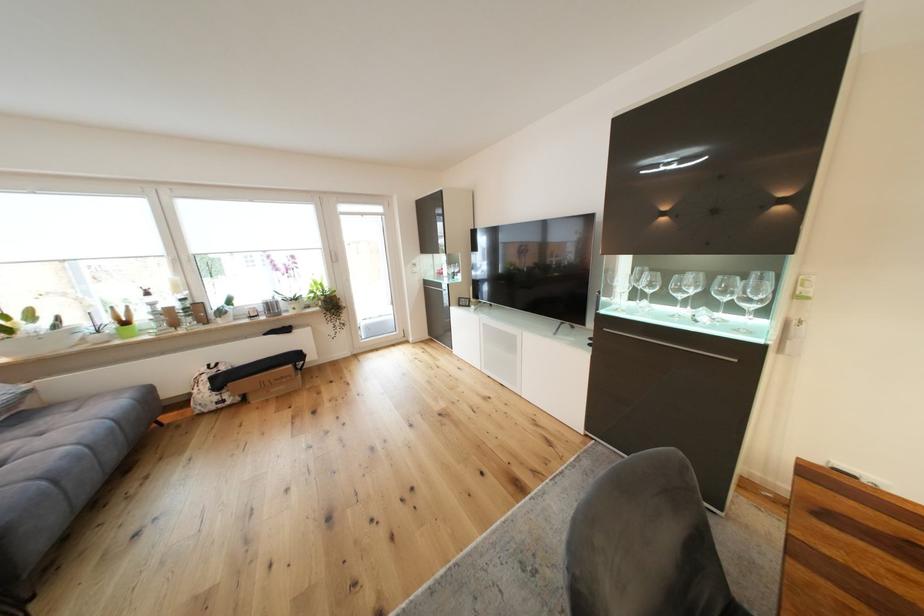
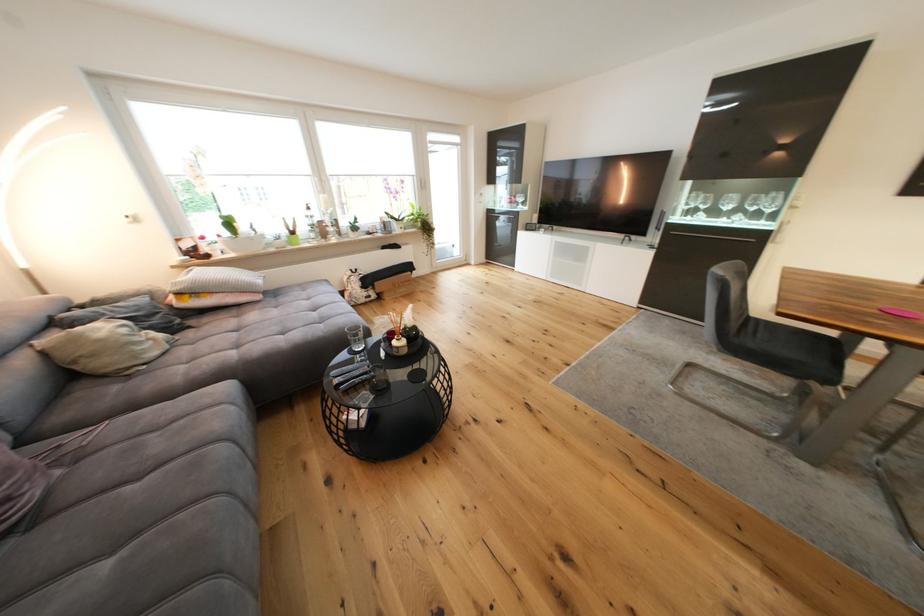
The point at (645, 270) is marked in the first image. Where is the corresponding point in the second image?

(701, 195)